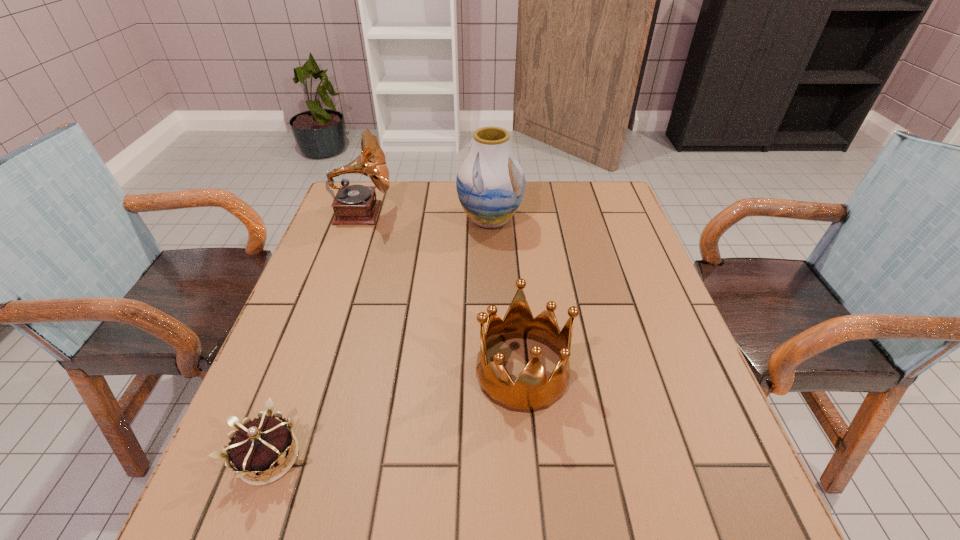
Image resolution: width=960 pixels, height=540 pixels. I want to click on vase present at the far edge, so click(490, 183).

At what (x,y) coordinates should I click in order to perform the action: click on phonograph_record present at the far edge. Please return your answer as a coordinate pair (x, y). Looking at the image, I should click on [355, 204].

I want to click on object that is at the near edge, so click(259, 446).

Where is `phonograph_record present at the left edge`? This screenshot has width=960, height=540. phonograph_record present at the left edge is located at coordinates (355, 204).

The image size is (960, 540). In order to click on crown located in the left edge section of the desktop in this screenshot , I will do `click(259, 446)`.

The height and width of the screenshot is (540, 960). Identify the location of object that is at the far left corner. (355, 204).

This screenshot has width=960, height=540. Identify the location of object at the near left corner. (259, 446).

Locate an element on the screen. The height and width of the screenshot is (540, 960). free space at the far edge is located at coordinates (548, 185).

Where is `vacant space at the left edge of the desktop`? This screenshot has width=960, height=540. vacant space at the left edge of the desktop is located at coordinates (371, 228).

This screenshot has height=540, width=960. I want to click on free point at the right edge, so click(x=688, y=401).